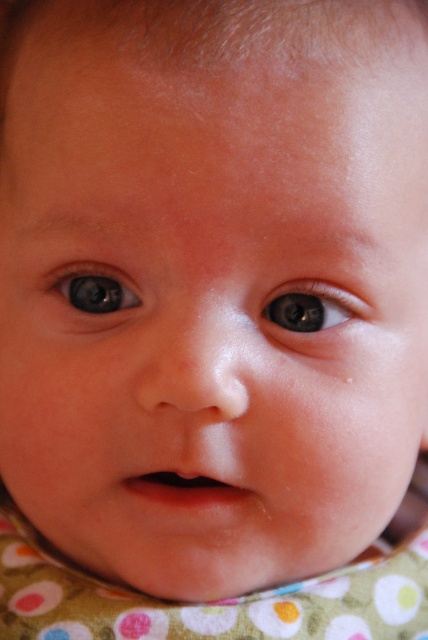
You are a photographer holding a camera. You want to take a closeup of the baby while ensuring the brown glossy eye at center is in focus. If your camera has a minimum focusing distance of 14 inches, will you be able to take the photo without moving closer?

The brown glossy eye at center and the viewer are 14.47 inches apart. Since the minimum focusing distance is 14 inches, the photographer can take the photo without moving closer because 14.47 inches is within the camera s capability.

You are a photographer taking a closeup of a baby. You notice two eyes in the image. The baby has a brown glossy eye at center and a blue glossy eye at center. Which eye is positioned to the right side of the other?

The brown glossy eye at center is positioned to the right of the blue glossy eye at center.

You are a photographer trying to focus on the baby in the image. The camera shows a point at coordinates (312, 305). Where is this point located?

The point at coordinates (312, 305) is located on the brown glossy eye at center.